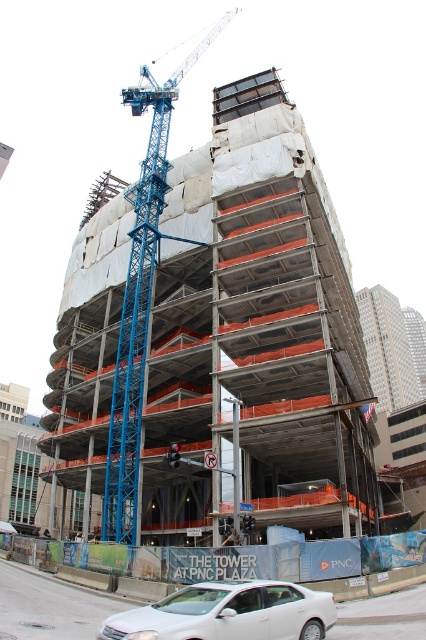
Question: Can you confirm if white concrete construction site at lower center is thinner than white matte sedan at lower center?

Choices:
 (A) yes
 (B) no

Answer: (B)

Question: Which of these objects is positioned farthest from the white matte sedan at lower center?

Choices:
 (A) white concrete construction site at lower center
 (B) blue metallic crane at center-left

Answer: (B)

Question: Which point is farther from the camera taking this photo?

Choices:
 (A) (351, 612)
 (B) (135, 611)

Answer: (A)

Question: Among these objects, which one is farthest from the camera?

Choices:
 (A) white matte sedan at lower center
 (B) blue metallic crane at center-left
 (C) white concrete construction site at lower center

Answer: (B)

Question: Is blue metallic crane at center-left wider than white matte sedan at lower center?

Choices:
 (A) no
 (B) yes

Answer: (B)

Question: Is blue metallic crane at center-left positioned before white concrete construction site at lower center?

Choices:
 (A) no
 (B) yes

Answer: (A)